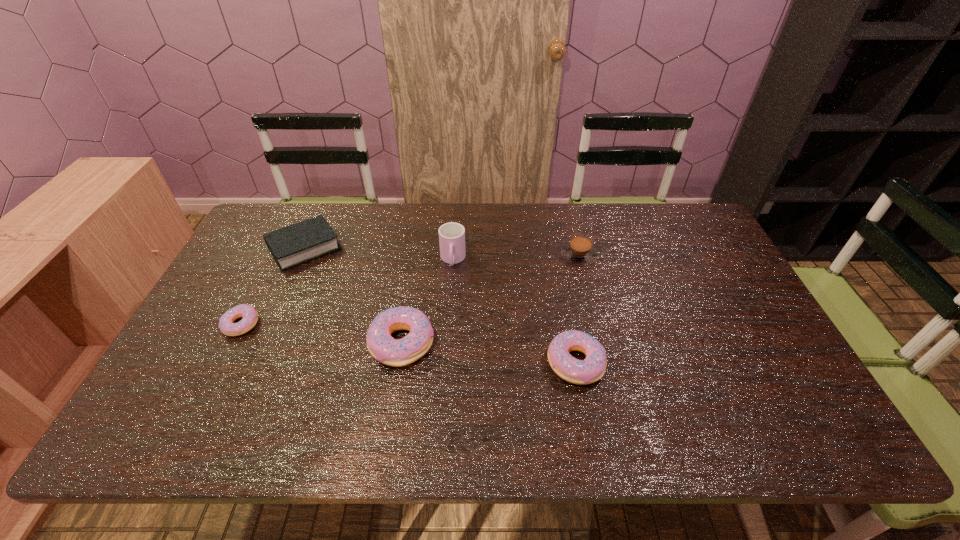
Identify the location of empty space that is in between the tallest object and the second shortest doughnut. (515, 312).

Locate an element on the screen. free spot between the cup and the rightmost doughnut is located at coordinates (515, 312).

Find the location of a particular element. The width and height of the screenshot is (960, 540). unoccupied area between the rightmost doughnut and the Bible is located at coordinates (441, 306).

This screenshot has height=540, width=960. In order to click on vacant space that is in between the leftmost doughnut and the cappuccino in this screenshot , I will do `click(410, 290)`.

Locate which object ranks fifth in proximity to the Bible. Please provide its 2D coordinates. Your answer should be formatted as a tuple, i.e. [(x, y)], where the tuple contains the x and y coordinates of a point satisfying the conditions above.

[(579, 250)]

Locate an element on the screen. object that can be found as the fifth closest to the cappuccino is located at coordinates (250, 316).

This screenshot has height=540, width=960. What are the coordinates of `doughnut that is the second closest to the second doughnut from left to right` in the screenshot? It's located at click(x=250, y=316).

Where is `doughnut that is the second closest one to the cappuccino`? This screenshot has height=540, width=960. doughnut that is the second closest one to the cappuccino is located at coordinates (382, 346).